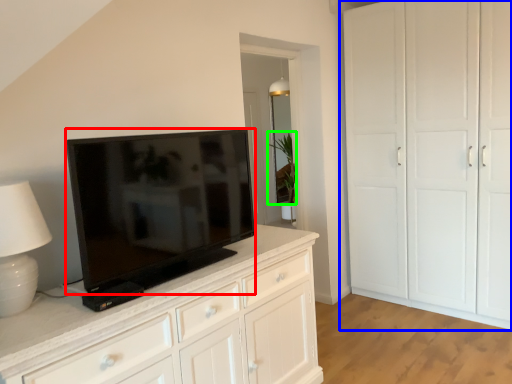
Question: Which object is the farthest from television (highlighted by a red box)? Choose among these: cupboard (highlighted by a blue box) or plant (highlighted by a green box).

Choices:
 (A) cupboard
 (B) plant

Answer: (B)